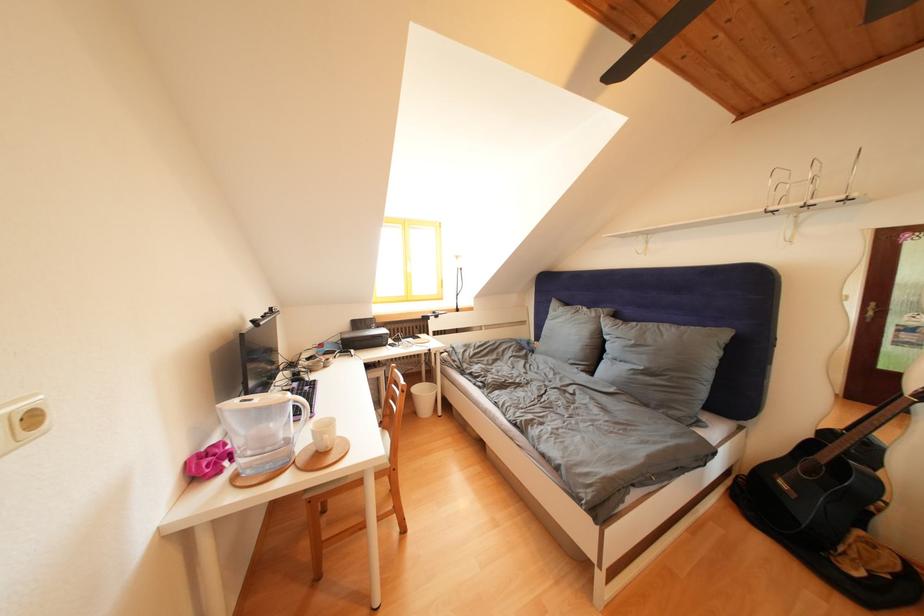
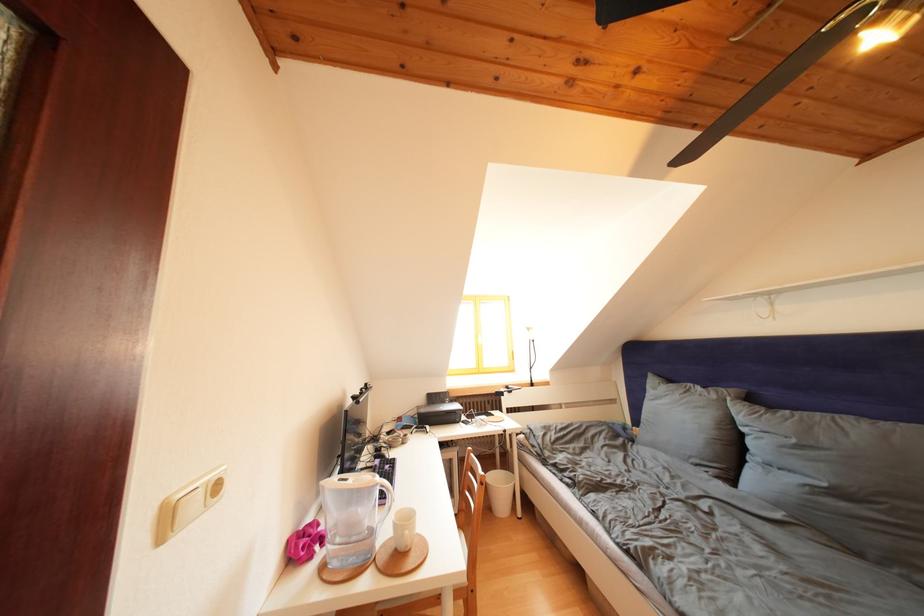
In the second image, find the point that corresponds to the point at 640,347 in the first image.

(801, 446)